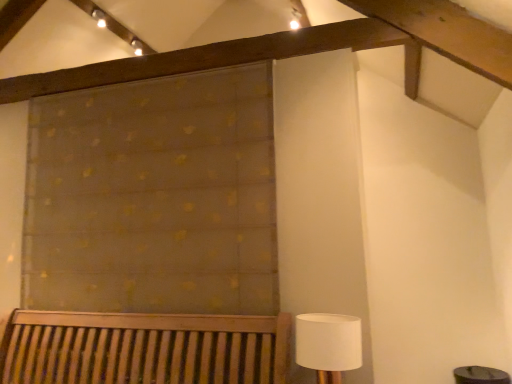
What is the approximate width of white fabric lampshade at lower right?

white fabric lampshade at lower right is 11.52 inches wide.

Describe the element at coordinates (328, 344) in the screenshot. I see `white fabric lampshade at lower right` at that location.

Image resolution: width=512 pixels, height=384 pixels. What are the coordinates of `white fabric lampshade at lower right` in the screenshot? It's located at (328, 344).

This screenshot has height=384, width=512. What do you see at coordinates (153, 197) in the screenshot?
I see `translucent gold-patterned curtain at upper center` at bounding box center [153, 197].

Where is `translucent gold-patterned curtain at upper center`? The width and height of the screenshot is (512, 384). translucent gold-patterned curtain at upper center is located at coordinates (153, 197).

Measure the distance between translucent gold-patterned curtain at upper center and camera.

translucent gold-patterned curtain at upper center is 2.29 meters from camera.

Where is `white fabric lampshade at lower right`? Image resolution: width=512 pixels, height=384 pixels. white fabric lampshade at lower right is located at coordinates (328, 344).

Considering the positions of objects white fabric lampshade at lower right and translucent gold-patterned curtain at upper center in the image provided, who is more to the left, white fabric lampshade at lower right or translucent gold-patterned curtain at upper center?

translucent gold-patterned curtain at upper center is more to the left.

Is the depth of white fabric lampshade at lower right greater than that of translucent gold-patterned curtain at upper center?

No, white fabric lampshade at lower right is closer to the viewer.

Does point (339, 347) appear closer or farther from the camera than point (83, 247)?

Point (339, 347) is closer to the camera than point (83, 247).

From the image's perspective, between white fabric lampshade at lower right and translucent gold-patterned curtain at upper center, which one is located above?

From the image's view, translucent gold-patterned curtain at upper center is above.

Consider the image. From a real-world perspective, is white fabric lampshade at lower right on top of translucent gold-patterned curtain at upper center?

No, from a real-world perspective, white fabric lampshade at lower right is not over translucent gold-patterned curtain at upper center

Between white fabric lampshade at lower right and translucent gold-patterned curtain at upper center, which one has smaller width?

Thinner between the two is translucent gold-patterned curtain at upper center.

Considering the sizes of white fabric lampshade at lower right and translucent gold-patterned curtain at upper center in the image, is white fabric lampshade at lower right taller or shorter than translucent gold-patterned curtain at upper center?

In the image, white fabric lampshade at lower right appears to be shorter than translucent gold-patterned curtain at upper center.

Based on the photo, can you confirm if white fabric lampshade at lower right is smaller than translucent gold-patterned curtain at upper center?

Yes, white fabric lampshade at lower right is smaller than translucent gold-patterned curtain at upper center.

Based on the photo, would you say white fabric lampshade at lower right is outside translucent gold-patterned curtain at upper center?

white fabric lampshade at lower right is positioned outside translucent gold-patterned curtain at upper center.

Is white fabric lampshade at lower right placed right next to translucent gold-patterned curtain at upper center?

No, white fabric lampshade at lower right is not making contact with translucent gold-patterned curtain at upper center.

Is white fabric lampshade at lower right facing towards translucent gold-patterned curtain at upper center?

No, white fabric lampshade at lower right does not turn towards translucent gold-patterned curtain at upper center.

Where is `table lamp that is under the translucent gold-patterned curtain at upper center (from a real-world perspective)`? table lamp that is under the translucent gold-patterned curtain at upper center (from a real-world perspective) is located at coordinates (328, 344).

Visually, is translucent gold-patterned curtain at upper center positioned to the left or to the right of white fabric lampshade at lower right?

In the image, translucent gold-patterned curtain at upper center appears on the left side of white fabric lampshade at lower right.

Is the position of translucent gold-patterned curtain at upper center more distant than that of white fabric lampshade at lower right?

Yes, it is behind white fabric lampshade at lower right.

Between point (90, 233) and point (332, 383), which one is positioned behind?

Positioned behind is point (90, 233).

From the image's perspective, which object appears higher, translucent gold-patterned curtain at upper center or white fabric lampshade at lower right?

translucent gold-patterned curtain at upper center.

From a real-world perspective, is translucent gold-patterned curtain at upper center on white fabric lampshade at lower right?

Yes, from a real-world perspective, translucent gold-patterned curtain at upper center is above white fabric lampshade at lower right.

Is translucent gold-patterned curtain at upper center thinner than white fabric lampshade at lower right?

Yes, translucent gold-patterned curtain at upper center is thinner than white fabric lampshade at lower right.

Which of these two, translucent gold-patterned curtain at upper center or white fabric lampshade at lower right, stands shorter?

white fabric lampshade at lower right.

Is translucent gold-patterned curtain at upper center bigger than white fabric lampshade at lower right?

Yes.

Can white fabric lampshade at lower right be found inside translucent gold-patterned curtain at upper center?

No, translucent gold-patterned curtain at upper center does not contain white fabric lampshade at lower right.

Can you see translucent gold-patterned curtain at upper center touching white fabric lampshade at lower right?

No, translucent gold-patterned curtain at upper center is not next to white fabric lampshade at lower right.

Could you tell me if translucent gold-patterned curtain at upper center is facing white fabric lampshade at lower right?

No, translucent gold-patterned curtain at upper center does not turn towards white fabric lampshade at lower right.

Identify the location of table lamp on the right of translucent gold-patterned curtain at upper center. The height and width of the screenshot is (384, 512). (328, 344).

Identify the location of curtain on the left of white fabric lampshade at lower right. (153, 197).

Locate an element on the screen. This screenshot has height=384, width=512. table lamp lying on the right of translucent gold-patterned curtain at upper center is located at coordinates (328, 344).